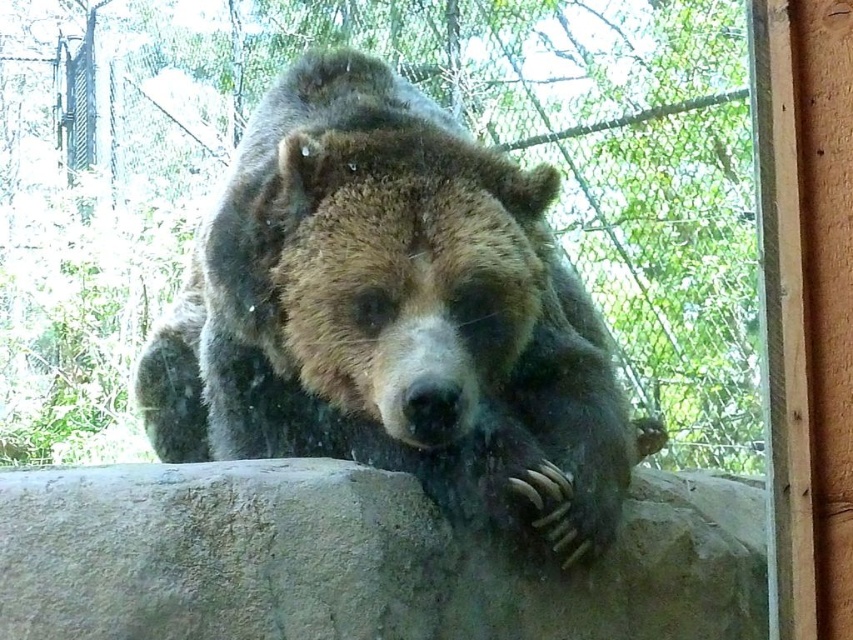
Question: Which of the following is the farthest from the observer?

Choices:
 (A) fuzzy brown bear at center
 (B) gray rough boulder at center

Answer: (A)

Question: Can you confirm if fuzzy brown bear at center is bigger than gray rough boulder at center?

Choices:
 (A) yes
 (B) no

Answer: (A)

Question: Is fuzzy brown bear at center wider than gray rough boulder at center?

Choices:
 (A) no
 (B) yes

Answer: (A)

Question: Which point appears farthest from the camera in this image?

Choices:
 (A) (491, 276)
 (B) (184, 513)

Answer: (A)

Question: Where is fuzzy brown bear at center located in relation to gray rough boulder at center in the image?

Choices:
 (A) right
 (B) left

Answer: (B)